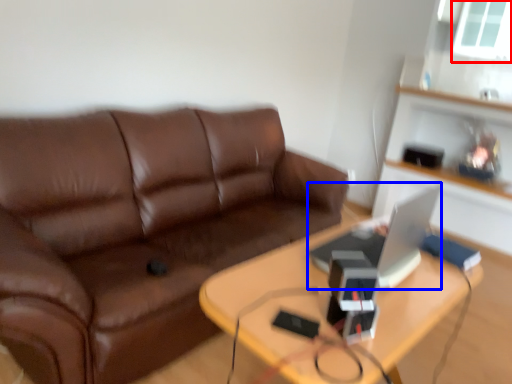
Question: Which object appears farthest to the camera in this image, window screen (highlighted by a red box) or computer (highlighted by a blue box)?

Choices:
 (A) window screen
 (B) computer

Answer: (A)